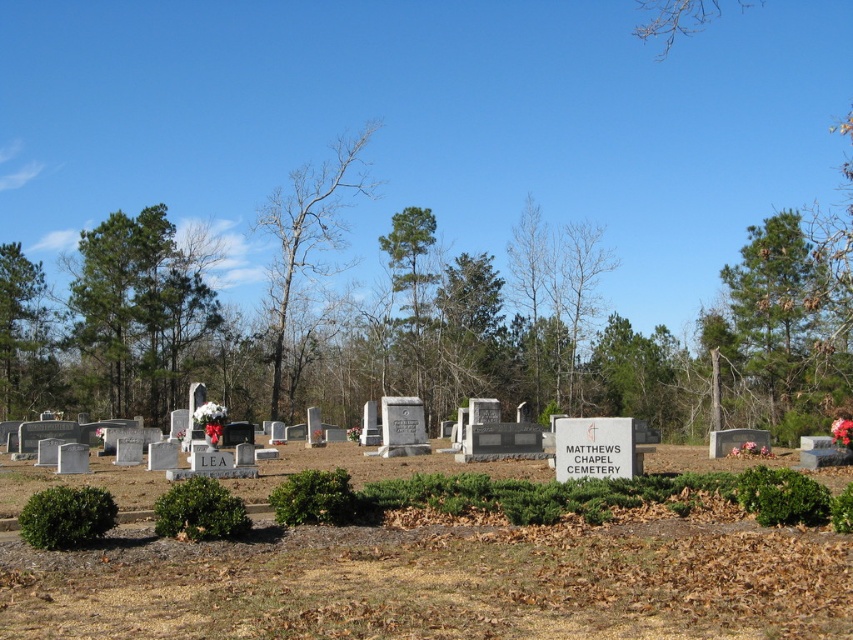
You are standing at the entrance of the cemetery and see two points in the image. The first point is located at coordinates point (788,310) and the second is at point (16,259). Which point is closer to you?

Point (788,310) is closer to the camera than point (16,259).

You are standing in the cemetery and want to place a new headstone between the two points marked as point [18,381] and point [412,339]. Which point should the headstone be closer to if you want it to be nearer to the sign that reads MATTHEWS CHAPEL CEMETERY?

The headstone should be placed closer to point [18,381] because it is closer to the viewer than point [412,339], meaning it is physically nearer to the sign located in the center right of the scene.